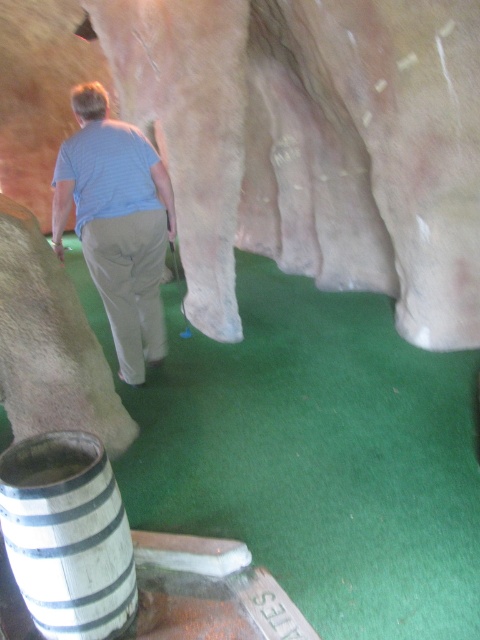
From the picture: You are standing at point (22, 536) and want to walk towards the camera. Which direction should you move to reach the camera without passing through point (195, 532)?

You should move towards the direction of the camera, which is towards the top of the image, since point (195, 532) is further towards the camera than point (22, 536). Moving upwards will avoid passing through point (195, 532).